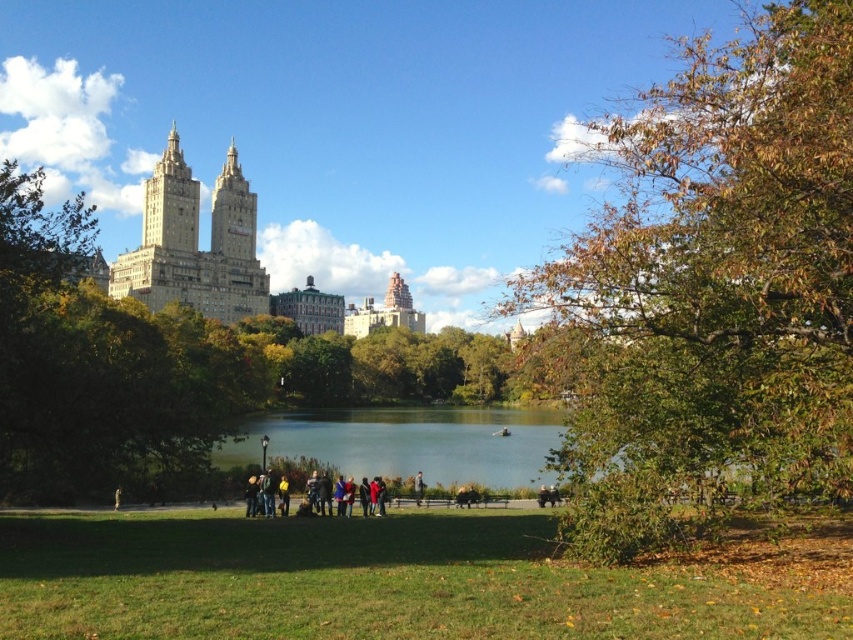
Between point (595, 266) and point (264, 499), which one is positioned behind?

Point (264, 499)

Which is in front, point (747, 116) or point (265, 506)?

Point (747, 116) is in front.

I want to click on green leafy tree at center, so click(x=715, y=285).

Between clear blue water at center and brown leather jacket at center, which one appears on the left side from the viewer's perspective?

Positioned to the left is clear blue water at center.

Is clear blue water at center taller than brown leather jacket at center?

Yes, clear blue water at center is taller than brown leather jacket at center.

Is point (463, 467) farther from viewer compared to point (422, 476)?

That is True.

Where is `clear blue water at center`? This screenshot has width=853, height=640. clear blue water at center is located at coordinates (410, 444).

Does point (437, 454) come closer to viewer compared to point (286, 508)?

No, (437, 454) is further to viewer.

Between point (302, 424) and point (287, 515), which one is positioned behind?

Positioned behind is point (302, 424).

Locate an element on the screen. This screenshot has width=853, height=640. clear blue water at center is located at coordinates (410, 444).